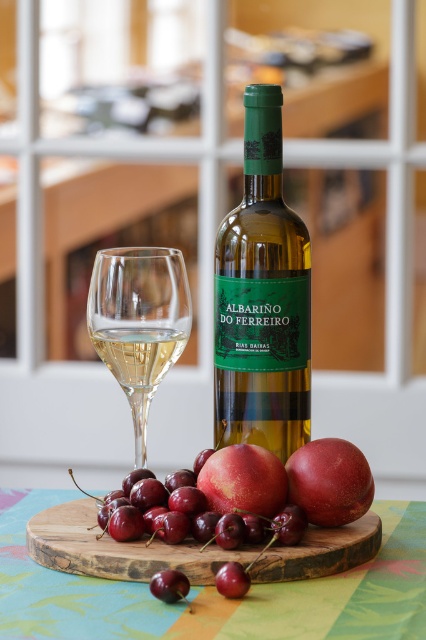
Question: Among these objects, which one is farthest from the camera?

Choices:
 (A) glossy peach at center
 (B) glossy red apple at center
 (C) green glass bottle at center
 (D) clear glass wine at center

Answer: (C)

Question: Is clear glass wine glass at center further to the viewer compared to glossy peach at center?

Choices:
 (A) yes
 (B) no

Answer: (A)

Question: Can you confirm if green glass bottle at center is thinner than clear glass wine glass at center?

Choices:
 (A) no
 (B) yes

Answer: (B)

Question: Among these objects, which one is nearest to the camera?

Choices:
 (A) clear glass wine at center
 (B) wooden at center
 (C) glossy red apple at center
 (D) glossy peach at center

Answer: (B)

Question: Which object is positioned farthest from the glossy peach at center?

Choices:
 (A) wooden at center
 (B) clear glass wine glass at center

Answer: (B)

Question: Can you confirm if clear glass wine glass at center is wider than clear glass wine at center?

Choices:
 (A) no
 (B) yes

Answer: (B)